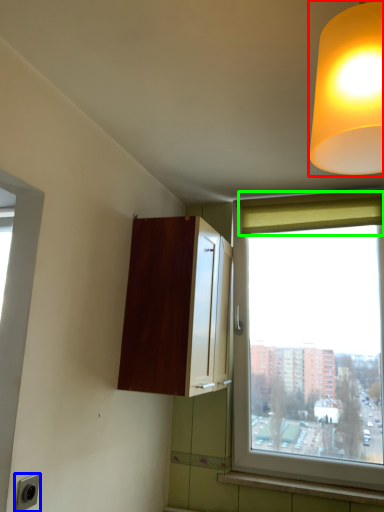
Question: Which is nearer to the lamp (highlighted by a red box)? electric outlet (highlighted by a blue box) or curtain (highlighted by a green box).

Choices:
 (A) electric outlet
 (B) curtain

Answer: (A)